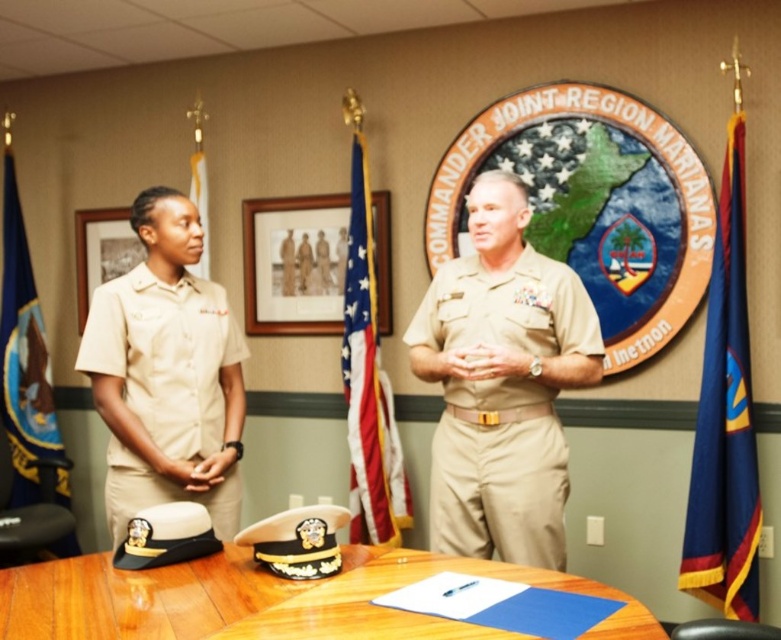
Locate an element on the screen. wooden table at center is located at coordinates (264, 600).

Between point (416, 634) and point (195, 188), which one is positioned behind?

Point (195, 188)

I want to click on wooden table at center, so click(264, 600).

Which is behind, point (540, 557) or point (193, 202)?

The point (193, 202) is behind.

Is point (551, 323) more distant than point (194, 273)?

No.

Describe the element at coordinates (501, 404) in the screenshot. Image resolution: width=781 pixels, height=640 pixels. I see `tan fabric uniform at center` at that location.

I want to click on tan fabric uniform at center, so click(x=501, y=404).

Is point (482, 323) positioned before point (394, 496)?

Yes, point (482, 323) is in front of point (394, 496).

Who is more distant from viewer, (458,385) or (366,298)?

Point (366,298)

Find the location of `tan fabric uniform at center`. tan fabric uniform at center is located at coordinates (501, 404).